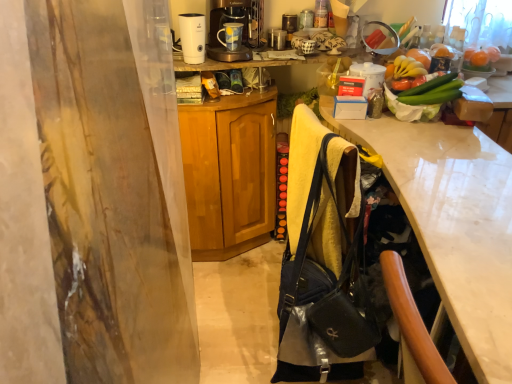
At what (x,y) coordinates should I click in order to perform the action: click on vacant area that is in front of white glossy mug at upper center, which appears as the 2th appliance when viewed from the top. Please return your answer as a coordinate pair (x, y). Looking at the image, I should click on (377, 124).